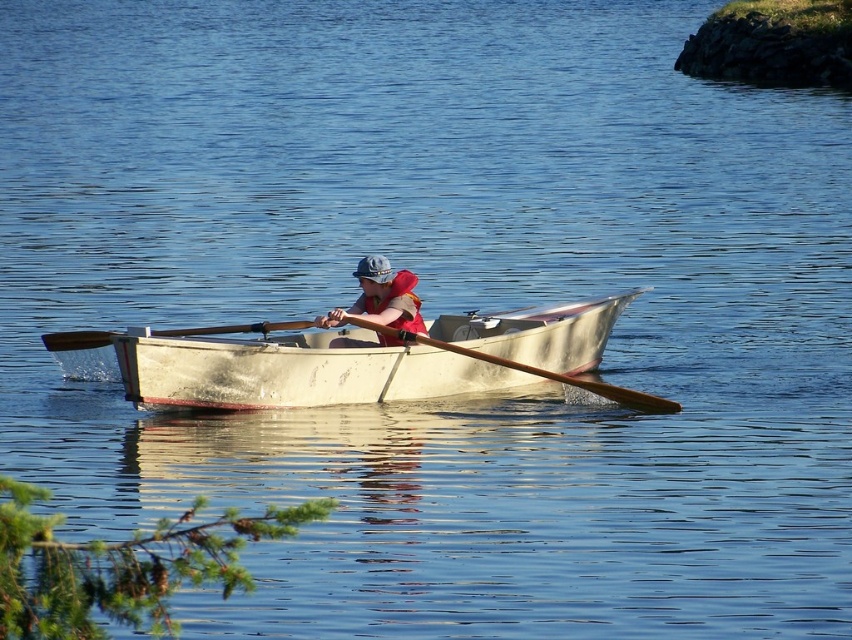
You are a safety inspector checking the boat setup. The white weathered boat at center must have the matte red life vest at center properly attached to it. Based on their positions, can you confirm if the life vest is correctly secured to the boat?

The white weathered boat at center is located below the matte red life vest at center, which suggests that the life vest is positioned above the boat. This placement indicates that the life vest is likely correctly secured to the boat.

You are a safety inspector checking the location of the boat in the image. The coordinates provided are point (366, 360). Based on the scene, what object is located at this point?

The point (366, 360) corresponds to the white weathered boat at center.

You are a safety inspector checking the boat for proper equipment. You notice the brown wooden paddle at center and the red matte life jacket at center. Which item is shorter?

The brown wooden paddle at center is not as tall as the red matte life jacket at center, so the brown wooden paddle at center is shorter.